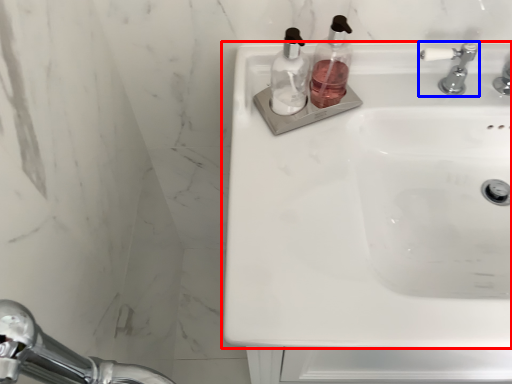
Question: Which of the following is the closest to the observer, sink (highlighted by a red box) or tap (highlighted by a blue box)?

Choices:
 (A) sink
 (B) tap

Answer: (A)